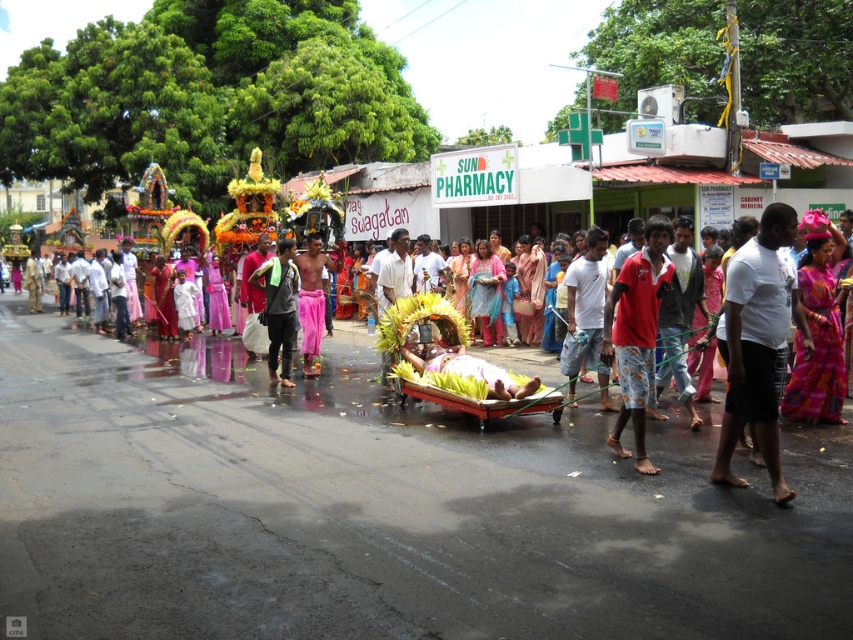
You are a photographer at the event and want to capture both the red cotton shirt at center and the silky pink saree at right in a single frame. Which clothing item will appear smaller in the photo?

The red cotton shirt at center will appear smaller in the photo because it has a smaller size compared to the silky pink saree at right.

You are a photographer trying to capture the entire scene of the procession. You notice two points marked in the image, point (637, 406) and point (827, 380). Which point is positioned closer to your camera lens?

Point (637, 406) is closer to the camera than point (827, 380).

You are a photographer standing in the crowd observing the cultural procession. You notice two participants wearing a red cotton shirt at center and a silky pink saree at right. Which participant is positioned closer to you?

The red cotton shirt at center is closer to the viewer than the silky pink saree at right.